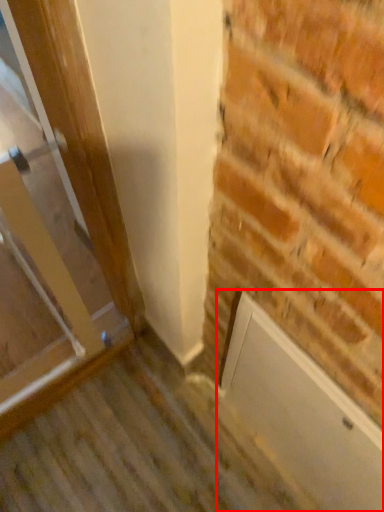
Question: Observing the image, what is the correct spatial positioning of screen door (annotated by the red box) in reference to door?

Choices:
 (A) left
 (B) right

Answer: (B)